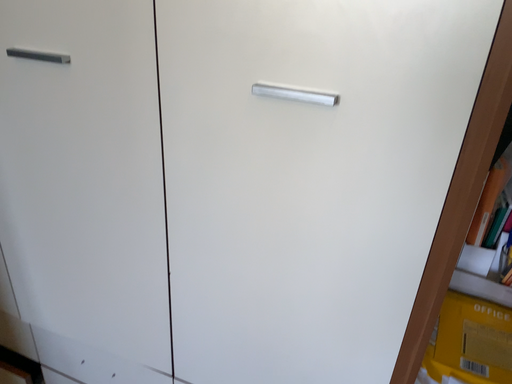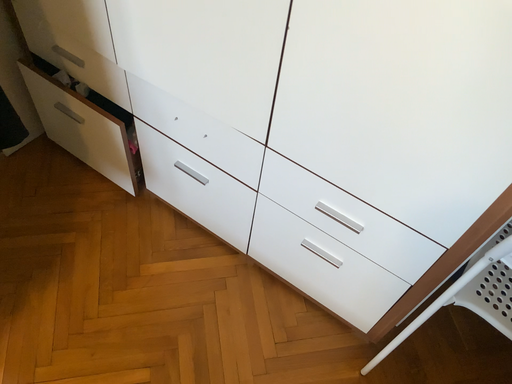
Question: Which way did the camera rotate in the video?

Choices:
 (A) rotated right
 (B) rotated left

Answer: (B)